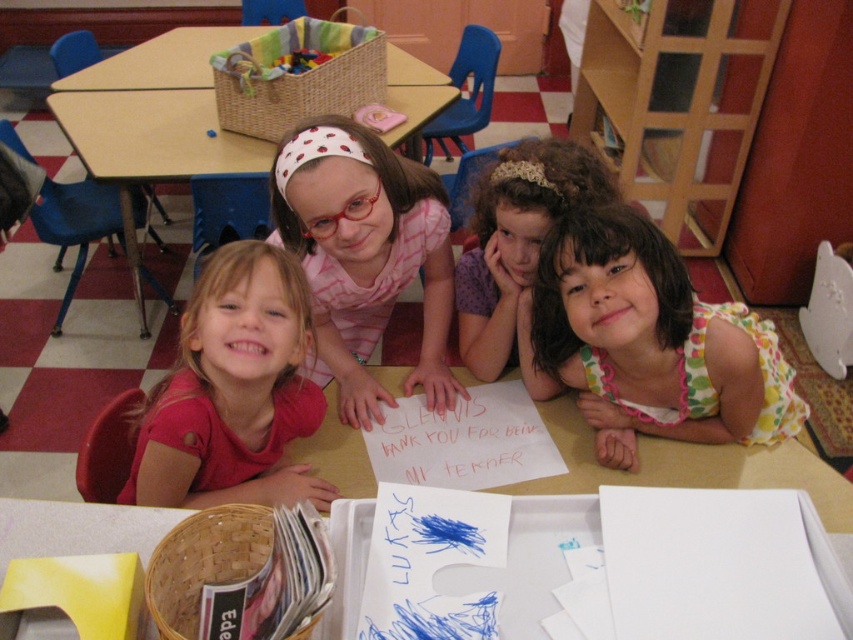
Question: Among these points, which one is farthest from the camera?

Choices:
 (A) (204, 163)
 (B) (735, 378)
 (C) (497, 189)
 (D) (178, 480)

Answer: (A)

Question: Which point is closer to the camera?

Choices:
 (A) matte pink shirt at center
 (B) wooden table at center
 (C) curly-haired girl at center

Answer: (A)

Question: Which point is closer to the camera taking this photo?

Choices:
 (A) (500, 228)
 (B) (413, 115)
 (C) (546, 241)

Answer: (C)

Question: Does floral dress at center have a greater width compared to matte pink shirt at center?

Choices:
 (A) no
 (B) yes

Answer: (B)

Question: Does floral dress at center appear over matte pink shirt at center?

Choices:
 (A) no
 (B) yes

Answer: (A)

Question: From the image, what is the correct spatial relationship of matte pink shirt at center in relation to wooden table at center?

Choices:
 (A) below
 (B) above

Answer: (A)